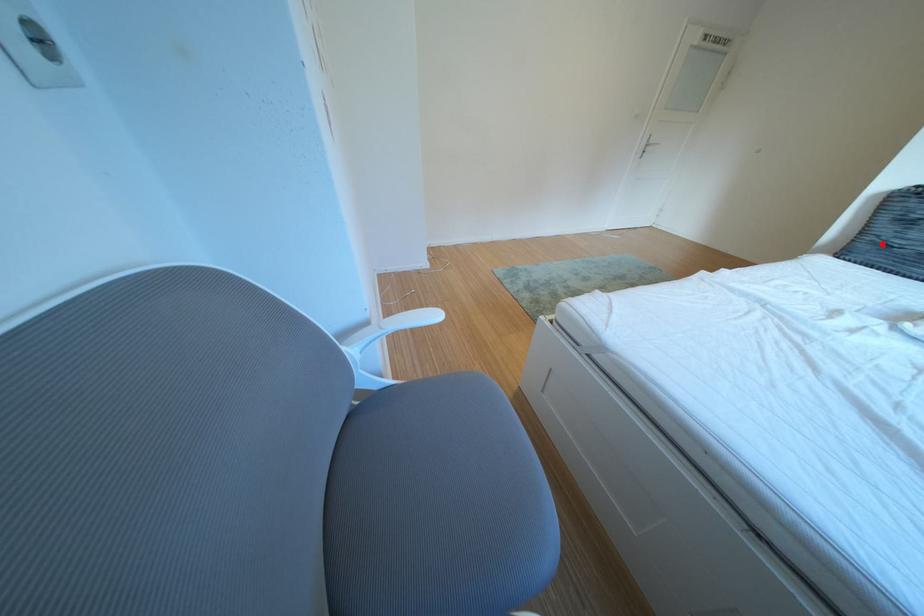
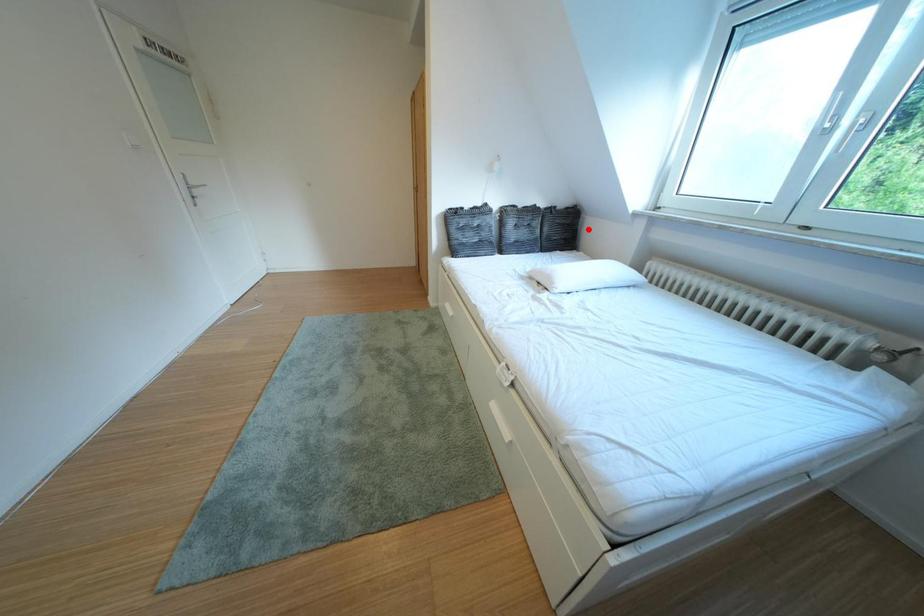
I am providing you with two images of the same scene from different viewpoints. A red point is marked on the first image and another point is marked on the second image. Are the points marked in image1 and image2 representing the same 3D position?

No